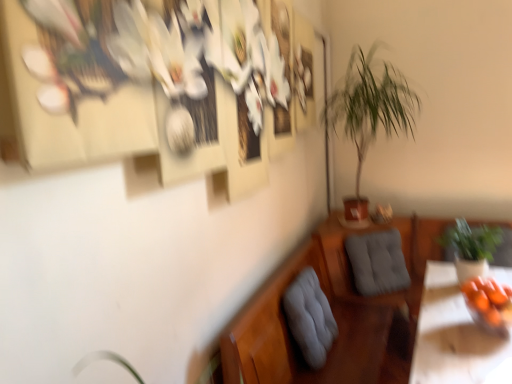
Question: Considering the positions of green leafy plant at center-right, which is the second houseplant from right to left, and gray fabric cushion at lower center, arranged as the second swivel chair when viewed from the right, in the image, is green leafy plant at center-right, which is the second houseplant from right to left, wider or thinner than gray fabric cushion at lower center, arranged as the second swivel chair when viewed from the right,?

Choices:
 (A) thin
 (B) wide

Answer: (B)

Question: Is green leafy plant at center-right, arranged as the 2th houseplant when ordered from the bottom, inside or outside of gray fabric cushion at lower center, the 1th swivel chair in the left-to-right sequence?

Choices:
 (A) outside
 (B) inside

Answer: (A)

Question: Estimate the real-world distances between objects in this image. Which object is closer to the gray fabric cushion at lower center, which ranks as the second swivel chair in back-to-front order?

Choices:
 (A) gray fabric swivel chair at center, acting as the first swivel chair starting from the right
 (B) green leafy plant at right, the second houseplant from the left
 (C) orange matte bowl at lower right
 (D) green leafy plant at center-right, which is the second houseplant from right to left

Answer: (C)

Question: Based on their relative distances, which object is nearer to the orange matte bowl at lower right?

Choices:
 (A) green leafy plant at center-right, which is the second houseplant from right to left
 (B) green leafy plant at right, which ranks as the second houseplant in top-to-bottom order
 (C) gray fabric cushion at lower center, which ranks as the second swivel chair in back-to-front order
 (D) gray fabric swivel chair at center, acting as the first swivel chair starting from the right

Answer: (B)